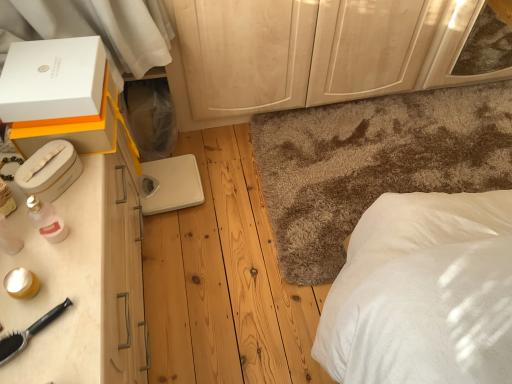
Identify the location of vacant area on top of white matte box at upper left, which ranks as the 3th box in bottom-to-top order (from a real-world perspective). The image size is (512, 384). (42, 65).